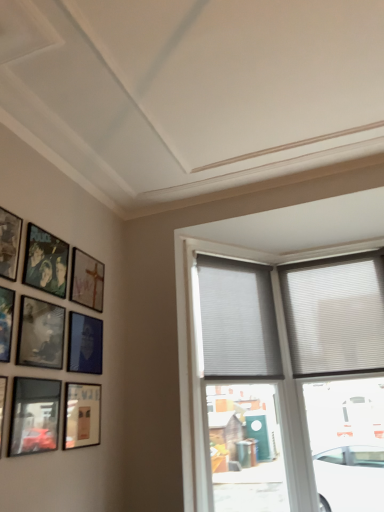
Question: In terms of height, does white pleated blinds at upper center, the 1th window positioned from the left, look taller or shorter compared to metallic silver picture frame at left, which is counted as the eighth picture frame, starting from the back?

Choices:
 (A) tall
 (B) short

Answer: (A)

Question: Considering the positions of white pleated blinds at upper center, the 1th window positioned from the left, and metallic silver picture frame at left, which is counted as the eighth picture frame, starting from the back, in the image, is white pleated blinds at upper center, the 1th window positioned from the left, bigger or smaller than metallic silver picture frame at left, which is counted as the eighth picture frame, starting from the back,?

Choices:
 (A) big
 (B) small

Answer: (A)

Question: Which object is positioned closest to the white pleated blinds at upper center, the 3th window in the right-to-left sequence?

Choices:
 (A) matte black picture frame at upper left, the 5th picture frame from the front
 (B) matte black picture frame at upper left, the 3th picture frame positioned from the front
 (C) metallic reflective frame at lower left, placed as the 4th picture frame when sorted from front to back
 (D) wooden frame at upper left, marked as the 1th picture frame in a back-to-front arrangement
 (E) white textured blinds at upper right, which appears as the second window when viewed from the left

Answer: (E)

Question: Which object is positioned farthest from the matte black picture frame at upper left, positioned as the 6th picture frame in front-to-back order?

Choices:
 (A) metallic reflective frame at lower left, placed as the 4th picture frame when sorted from front to back
 (B) matte gold picture frame at lower left, which is counted as the 3th picture frame, starting from the back
 (C) white pleated blinds at upper center, the 3th window in the right-to-left sequence
 (D) matte black picture frame at upper left, the 5th picture frame viewed from the back
 (E) matte black picture frame at lower left, which ranks as the 9th picture frame in back-to-front order

Answer: (C)